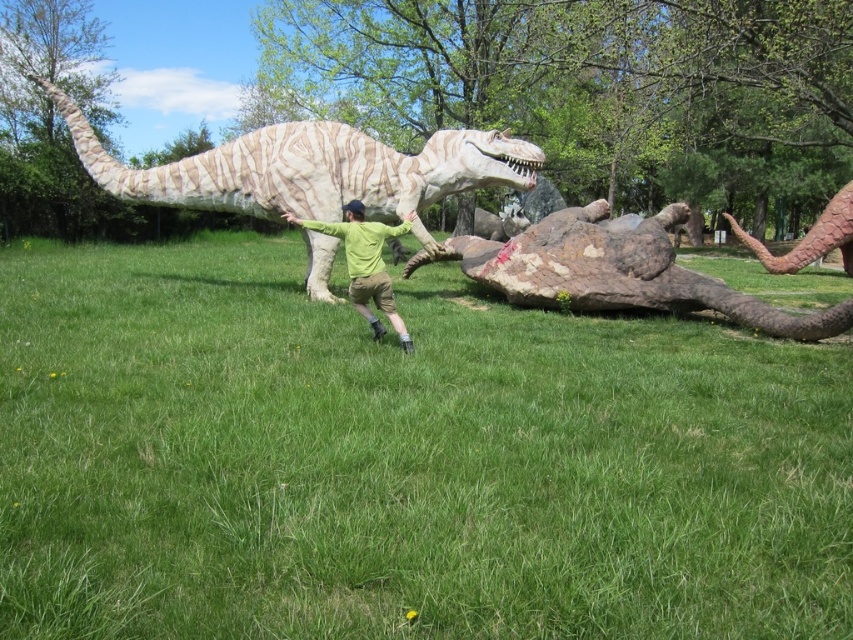
Can you confirm if green grass at center is wider than brown textured tail at right?

Indeed, green grass at center has a greater width compared to brown textured tail at right.

The width and height of the screenshot is (853, 640). Find the location of `green grass at center`. green grass at center is located at coordinates (401, 460).

Can you confirm if green grass at center is positioned to the left of green matte shirt at center?

No, green grass at center is not to the left of green matte shirt at center.

Who is positioned more to the left, green grass at center or green matte shirt at center?

green matte shirt at center is more to the left.

Does point (263, 552) come closer to viewer compared to point (381, 262)?

That is True.

You are a GUI agent. You are given a task and a screenshot of the screen. Output one action in this format:
    pyautogui.click(x=<x>, y=<y>)
    Task: Click on the green grass at center
    
    Given the screenshot: What is the action you would take?
    pyautogui.click(x=401, y=460)

Can you confirm if green grass at center is taller than white textured dinosaur at center?

Yes, green grass at center is taller than white textured dinosaur at center.

Is point (151, 339) positioned before point (115, 163)?

Yes, it is in front of point (115, 163).

This screenshot has width=853, height=640. I want to click on green grass at center, so click(401, 460).